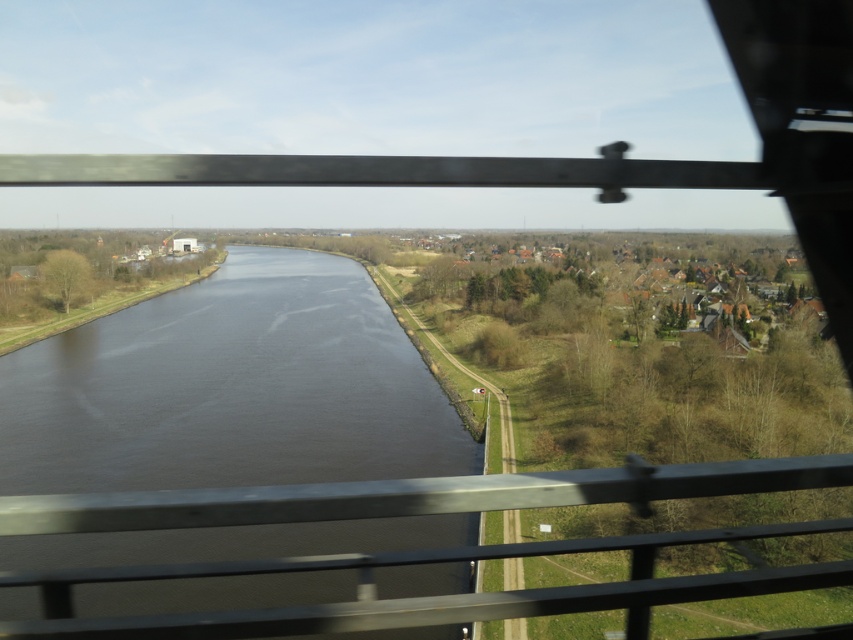
Which of these two, dark water at center or metallic gray rail at center, stands taller?

With more height is dark water at center.

Image resolution: width=853 pixels, height=640 pixels. Describe the element at coordinates (230, 388) in the screenshot. I see `dark water at center` at that location.

Image resolution: width=853 pixels, height=640 pixels. Identify the location of dark water at center. (230, 388).